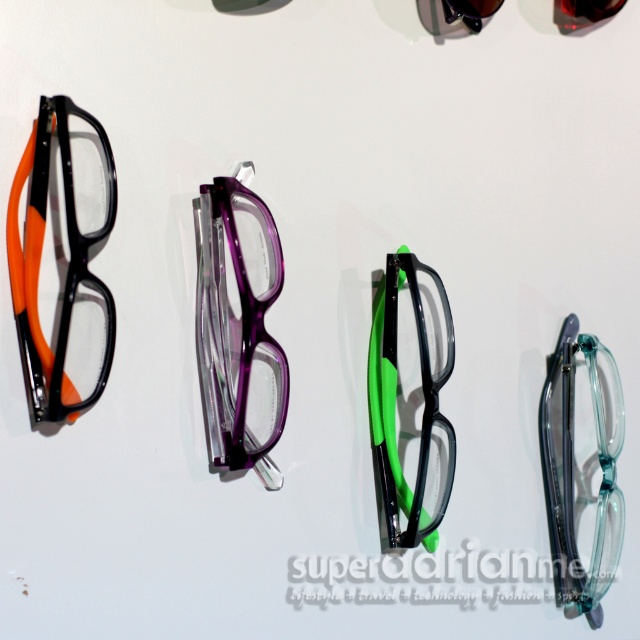
Can you confirm if matte black glasses at left is bigger than transparent plastic glasses at right?

Correct, matte black glasses at left is larger in size than transparent plastic glasses at right.

Is matte black glasses at left closer to camera compared to transparent plastic glasses at right?

Yes, matte black glasses at left is in front of transparent plastic glasses at right.

Image resolution: width=640 pixels, height=640 pixels. In order to click on matte black glasses at left in this screenshot , I will do `click(61, 259)`.

This screenshot has width=640, height=640. Find the location of `matte black glasses at left`. matte black glasses at left is located at coordinates (61, 259).

Between matte black glasses at left and black matte/glossy glasses at center, which one has less height?

Standing shorter between the two is black matte/glossy glasses at center.

Which is behind, point (61, 157) or point (429, 492)?

The point (429, 492) is behind.

At what (x,y) coordinates should I click in order to perform the action: click on matte black glasses at left. Please return your answer as a coordinate pair (x, y). The width and height of the screenshot is (640, 640). Looking at the image, I should click on (61, 259).

Does matte black glasses at left appear on the left side of purple translucent glasses at center?

Yes, matte black glasses at left is to the left of purple translucent glasses at center.

Is matte black glasses at left above purple translucent glasses at center?

Indeed, matte black glasses at left is positioned over purple translucent glasses at center.

Which is in front, point (10, 212) or point (209, 328)?

Point (10, 212) is more forward.

The image size is (640, 640). I want to click on matte black glasses at left, so click(61, 259).